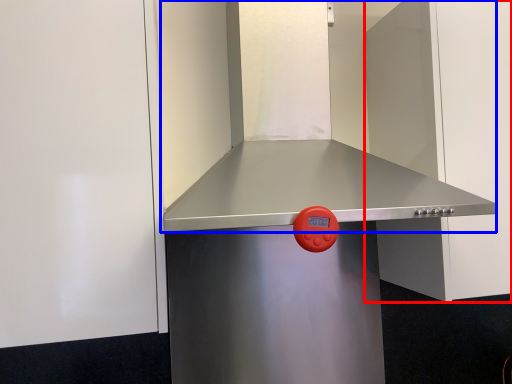
Question: Among these objects, which one is farthest to the camera, door (highlighted by a red box) or vent (highlighted by a blue box)?

Choices:
 (A) door
 (B) vent

Answer: (A)